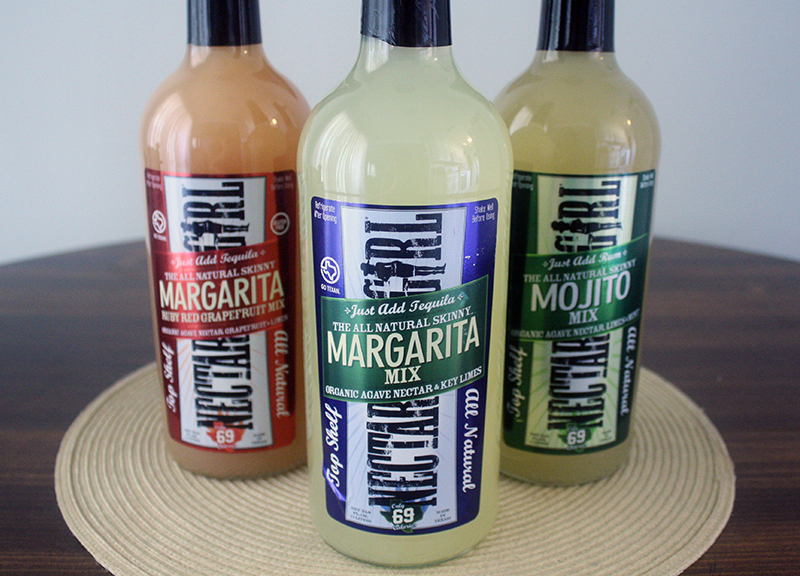
Where is `bottle`? The width and height of the screenshot is (800, 576). bottle is located at coordinates (362, 394).